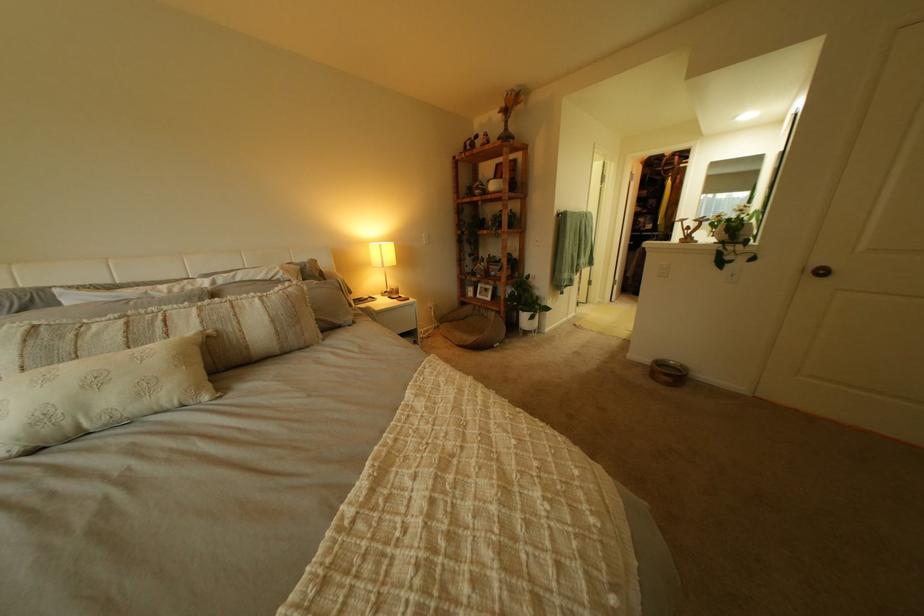
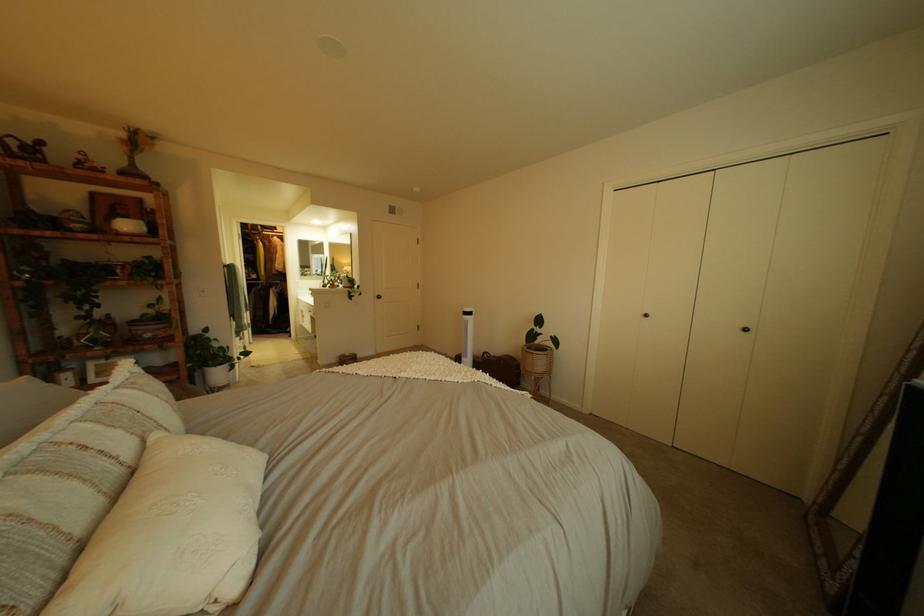
Find the pixel in the second image that matches point (693, 159) in the first image.

(274, 228)